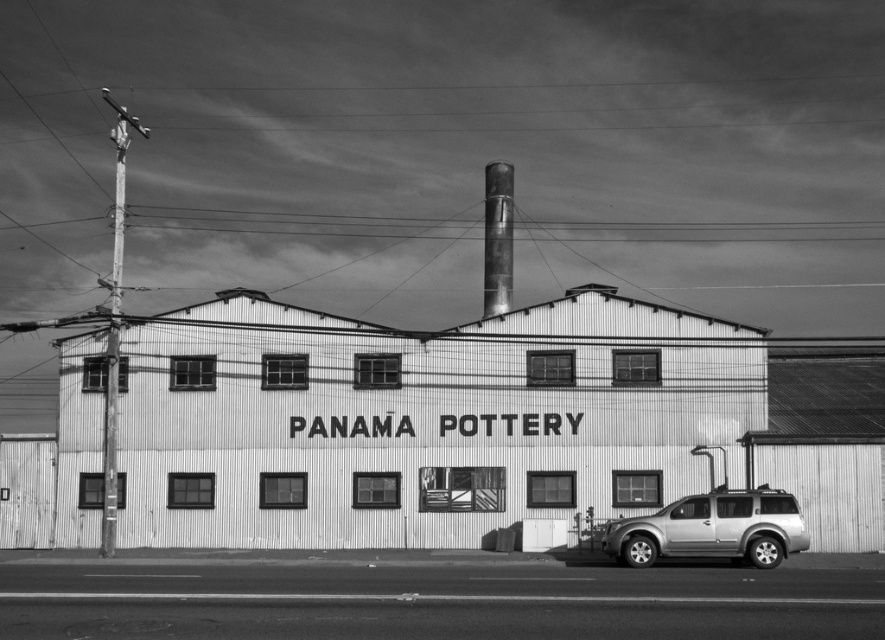
You are standing in front of the PANAMA POTTERY building and want to cross the road to reach the SUV parked on the right side. The road is 5 meters wide. If you walk straight towards the SUV from your current position, will you have to walk past the metallic corrugated building at center first?

The metallic corrugated building at center is 35.35 meters away from you. Since the road is only 5 meters wide, you would need to walk around or behind the building to reach the SUV parked on the right side, so you would not have to walk past the building first to cross the road.

You are standing on the paved road in front of the PANAMA POTTERY building. You see the metallic corrugated building at center and the silver metallic suv at lower right. Which object is closer to the left side of the road?

The metallic corrugated building at center is positioned on the left side of the silver metallic suv at lower right, so the metallic corrugated building at center is closer to the left side of the road.

You are a delivery driver approaching the PANAMA POTTERY building. You see the metallic corrugated building at center and the silver metallic suv at lower right. Which object is closer to you as you drive towards the building?

The metallic corrugated building at center is closer to you because the silver metallic suv at lower right is behind it.